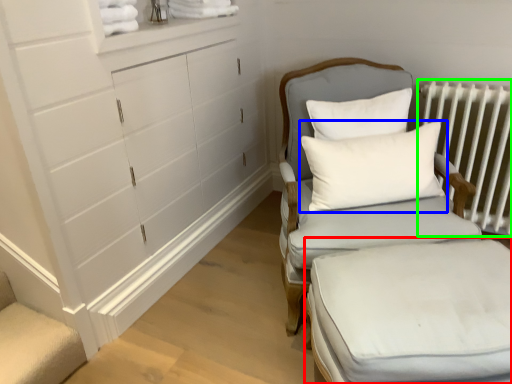
Question: Which object is positioned closest to changing table (highlighted by a red box)? Select from pillow (highlighted by a blue box) and radiator (highlighted by a green box).

Choices:
 (A) pillow
 (B) radiator

Answer: (A)